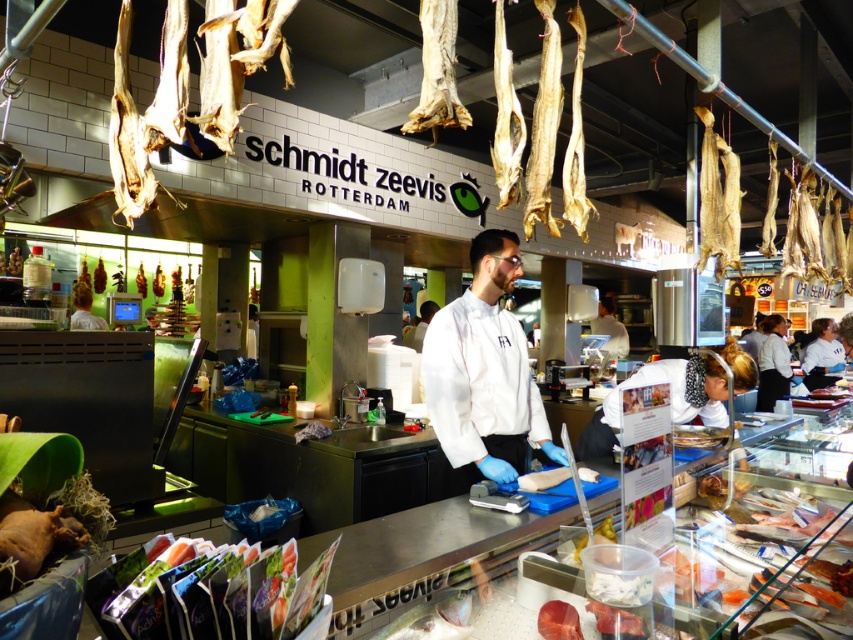
Question: Does pinkish raw meat at center come in front of shiny metallic knife at center?

Choices:
 (A) yes
 (B) no

Answer: (A)

Question: Estimate the real-world distances between objects in this image. Which object is closer to the shiny metallic knife at center?

Choices:
 (A) white chef coat at center
 (B) pinkish raw meat at center

Answer: (A)

Question: Is white chef coat at center positioned behind pinkish raw meat at center?

Choices:
 (A) yes
 (B) no

Answer: (A)

Question: Which point is farther to the camera?

Choices:
 (A) white chef coat at center
 (B) dried fish at upper center
 (C) shiny metallic knife at center
 (D) pinkish raw meat at center

Answer: (B)

Question: Is dried fish at upper center above shiny metallic knife at center?

Choices:
 (A) yes
 (B) no

Answer: (B)

Question: Which point appears farthest from the camera in this image?

Choices:
 (A) (538, 428)
 (B) (556, 618)
 (C) (102, 280)

Answer: (C)